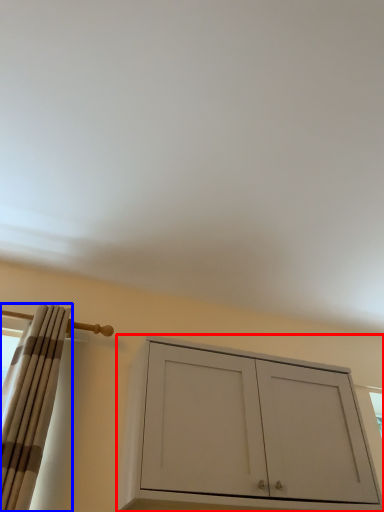
Question: Which point is closer to the camera, cabinetry (highlighted by a red box) or curtain (highlighted by a blue box)?

Choices:
 (A) cabinetry
 (B) curtain

Answer: (B)